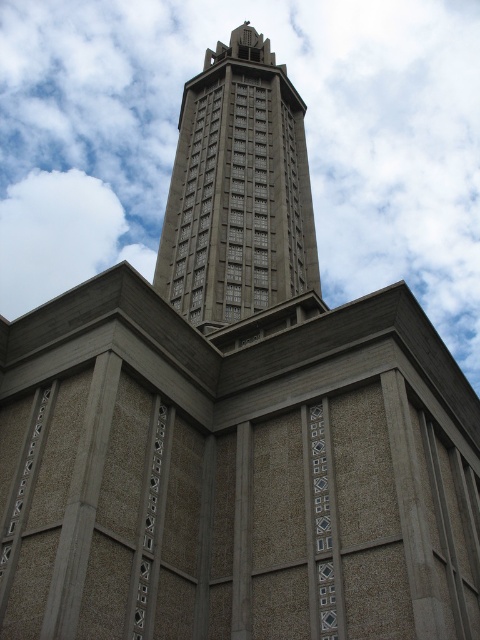
Where is `white fluffy cloud at upper center`? The height and width of the screenshot is (640, 480). white fluffy cloud at upper center is located at coordinates (305, 132).

Between white fluffy cloud at upper center and gray stone tower at center, which one is positioned lower?

Positioned lower is gray stone tower at center.

Does point (382, 148) come behind point (285, 145)?

Yes.

Image resolution: width=480 pixels, height=640 pixels. I want to click on white fluffy cloud at upper center, so click(x=305, y=132).